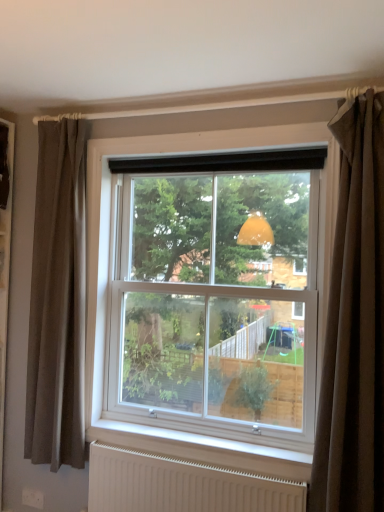
Find the location of `white plastic window at center`. white plastic window at center is located at coordinates (204, 297).

Image resolution: width=384 pixels, height=512 pixels. What are the coordinates of `white matte radiator at lower center` in the screenshot? It's located at (182, 485).

From a real-world perspective, is white matte radiator at lower center physically above brown fabric curtain at left, which ranks as the second curtain in front-to-back order?

No, from a real-world perspective, white matte radiator at lower center is not on top of brown fabric curtain at left, which ranks as the second curtain in front-to-back order.

From the picture: Which object is thinner, white matte radiator at lower center or brown fabric curtain at left, which ranks as the second curtain in front-to-back order?

Thinner between the two is white matte radiator at lower center.

Is white matte radiator at lower center facing away from brown fabric curtain at left, acting as the first curtain starting from the left?

No, white matte radiator at lower center is not facing the opposite direction of brown fabric curtain at left, acting as the first curtain starting from the left.

Which object is positioned more to the left, white matte radiator at lower center or brown fabric curtain at left, which ranks as the 2th curtain in right-to-left order?

brown fabric curtain at left, which ranks as the 2th curtain in right-to-left order.

From the picture: Is brown fabric curtain at left, which ranks as the second curtain in front-to-back order, at the back of brown fabric curtain at right, arranged as the first curtain when viewed from the front?

No, brown fabric curtain at right, arranged as the first curtain when viewed from the front, is not facing the opposite direction of brown fabric curtain at left, which ranks as the second curtain in front-to-back order.

Which of these two, brown fabric curtain at right, arranged as the first curtain when viewed from the front, or brown fabric curtain at left, which ranks as the first curtain in back-to-front order, is smaller?

With smaller size is brown fabric curtain at right, arranged as the first curtain when viewed from the front.

Is brown fabric curtain at right, which is the first curtain from right to left, far from brown fabric curtain at left, which ranks as the 2th curtain in right-to-left order?

Yes, brown fabric curtain at right, which is the first curtain from right to left, and brown fabric curtain at left, which ranks as the 2th curtain in right-to-left order, are quite far apart.

Which is nearer, (144, 233) or (183, 473)?

The point (183, 473) is closer to the camera.

Which object is thinner, white plastic window at center or white matte radiator at lower center?

Thinner between the two is white matte radiator at lower center.

This screenshot has width=384, height=512. Find the location of `radiator directly beneath the white plastic window at center (from a real-world perspective)`. radiator directly beneath the white plastic window at center (from a real-world perspective) is located at coordinates (182, 485).

Between white matte radiator at lower center and white plastic window at center, which one has more height?

With more height is white plastic window at center.

Measure the distance from white matte radiator at lower center to white plastic window at center.

They are 26.65 inches apart.

Is white matte radiator at lower center placed right next to white plastic window at center?

No.

Find the location of a particular element. The image size is (384, 512). window located behind the white matte radiator at lower center is located at coordinates (204, 297).

Does brown fabric curtain at right, which is the first curtain from right to left, turn towards white matte radiator at lower center?

No, brown fabric curtain at right, which is the first curtain from right to left, is not turned towards white matte radiator at lower center.

Does brown fabric curtain at right, which is the first curtain from right to left, come in front of white matte radiator at lower center?

Yes, it is.

Which is closer to the camera, (x=339, y=228) or (x=99, y=462)?

Point (x=339, y=228) is closer to the camera than point (x=99, y=462).

From the image's perspective, would you say brown fabric curtain at right, positioned as the second curtain in back-to-front order, is shown under white matte radiator at lower center?

A: No, from the image's perspective, brown fabric curtain at right, positioned as the second curtain in back-to-front order, is not below white matte radiator at lower center.

From the picture: From a real-world perspective, is white matte radiator at lower center below brown fabric curtain at right, positioned as the second curtain in back-to-front order?

Yes, from a real-world perspective, white matte radiator at lower center is beneath brown fabric curtain at right, positioned as the second curtain in back-to-front order.

Based on the photo, could you measure the distance between white matte radiator at lower center and brown fabric curtain at right, arranged as the first curtain when viewed from the front?

white matte radiator at lower center and brown fabric curtain at right, arranged as the first curtain when viewed from the front, are 29.04 inches apart from each other.

Is white matte radiator at lower center facing away from brown fabric curtain at right, positioned as the second curtain in back-to-front order?

No, white matte radiator at lower center is not facing away from brown fabric curtain at right, positioned as the second curtain in back-to-front order.

Considering the positions of objects white matte radiator at lower center and brown fabric curtain at right, which is the first curtain from right to left, in the image provided, who is more to the right, white matte radiator at lower center or brown fabric curtain at right, which is the first curtain from right to left,?

brown fabric curtain at right, which is the first curtain from right to left, is more to the right.

Would you consider brown fabric curtain at right, which is the first curtain from right to left, to be distant from white plastic window at center?

brown fabric curtain at right, which is the first curtain from right to left, is actually quite close to white plastic window at center.

Which point is more distant from viewer, (347,141) or (133,356)?

The point (133,356) is farther from the camera.

Between brown fabric curtain at right, arranged as the first curtain when viewed from the front, and white plastic window at center, which one has less height?

white plastic window at center.

This screenshot has height=512, width=384. Find the location of `curtain on the left side of white matte radiator at lower center`. curtain on the left side of white matte radiator at lower center is located at coordinates tap(58, 300).

There is a brown fabric curtain at left, which ranks as the second curtain in front-to-back order. At what (x,y) coordinates should I click in order to perform the action: click on curtain above it (from a real-world perspective). Please return your answer as a coordinate pair (x, y). The image size is (384, 512). Looking at the image, I should click on (354, 323).

From the image, which object appears to be farther from white plastic window at center, white matte radiator at lower center or brown fabric curtain at left, which ranks as the second curtain in front-to-back order?

white matte radiator at lower center is positioned further to the anchor white plastic window at center.

Looking at the image, which one is located further to brown fabric curtain at right, arranged as the first curtain when viewed from the front, white plastic window at center or white matte radiator at lower center?

The object further to brown fabric curtain at right, arranged as the first curtain when viewed from the front, is white matte radiator at lower center.

Considering their positions, is brown fabric curtain at left, acting as the first curtain starting from the left, positioned further to white plastic window at center than white matte radiator at lower center?

Based on the image, white matte radiator at lower center appears to be further to white plastic window at center.

Based on their spatial positions, is white matte radiator at lower center or white plastic window at center closer to brown fabric curtain at left, which ranks as the second curtain in front-to-back order?

Among the two, white plastic window at center is located nearer to brown fabric curtain at left, which ranks as the second curtain in front-to-back order.

Looking at the image, which one is located closer to white matte radiator at lower center, white plastic window at center or brown fabric curtain at right, the second curtain from the left?

The object closer to white matte radiator at lower center is white plastic window at center.

Estimate the real-world distances between objects in this image. Which object is further from brown fabric curtain at left, which ranks as the second curtain in front-to-back order, brown fabric curtain at right, arranged as the first curtain when viewed from the front, or white plastic window at center?

brown fabric curtain at right, arranged as the first curtain when viewed from the front, is further to brown fabric curtain at left, which ranks as the second curtain in front-to-back order.

Considering their positions, is brown fabric curtain at left, acting as the first curtain starting from the left, positioned closer to white matte radiator at lower center than brown fabric curtain at right, which is the first curtain from right to left?

brown fabric curtain at left, acting as the first curtain starting from the left, lies closer to white matte radiator at lower center than the other object.

In the scene shown: From the image, which object appears to be nearer to brown fabric curtain at left, which ranks as the first curtain in back-to-front order, white plastic window at center or brown fabric curtain at right, which is the first curtain from right to left?

Among the two, white plastic window at center is located nearer to brown fabric curtain at left, which ranks as the first curtain in back-to-front order.

Image resolution: width=384 pixels, height=512 pixels. In order to click on window between brown fabric curtain at left, which ranks as the 2th curtain in right-to-left order, and white matte radiator at lower center from top to bottom in this screenshot , I will do `click(204, 297)`.

Locate an element on the screen. This screenshot has width=384, height=512. radiator situated between brown fabric curtain at left, which ranks as the second curtain in front-to-back order, and brown fabric curtain at right, positioned as the second curtain in back-to-front order, from left to right is located at coordinates (182, 485).

Locate an element on the screen. curtain between white plastic window at center and white matte radiator at lower center from top to bottom is located at coordinates (354, 323).

Identify the location of window located between brown fabric curtain at left, which ranks as the 2th curtain in right-to-left order, and brown fabric curtain at right, the second curtain from the left, in the left-right direction. The height and width of the screenshot is (512, 384). (204, 297).